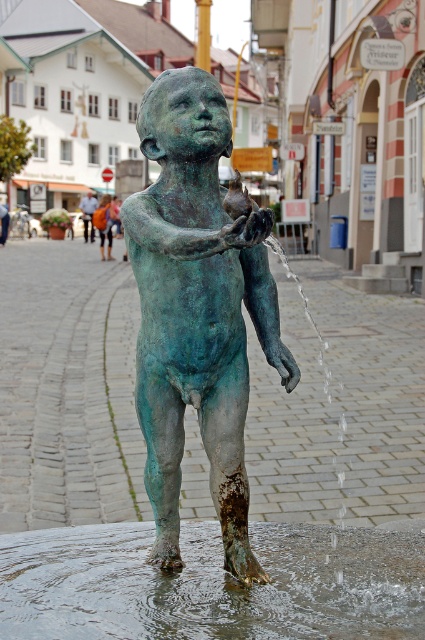
Which of these two, green patina statue at center or clear liquid water at lower center, stands shorter?

clear liquid water at lower center

Is green patina statue at center further to the viewer compared to clear liquid water at lower center?

No, green patina statue at center is closer to the viewer.

Find the location of a particular element. The height and width of the screenshot is (640, 425). green patina statue at center is located at coordinates (197, 310).

Locate an element on the screen. green patina statue at center is located at coordinates (197, 310).

Can you confirm if orange fabric bag at center is positioned above orange fabric backpack at center?

No, orange fabric bag at center is not above orange fabric backpack at center.

Is point (110, 195) positioned behind point (90, 196)?

Yes.

I want to click on orange fabric bag at center, so click(x=104, y=225).

At what (x,y) coordinates should I click in order to perform the action: click on orange fabric bag at center. Please return your answer as a coordinate pair (x, y). Looking at the image, I should click on (104, 225).

Is clear liquid water at lower center positioned at the back of orange fabric backpack at center?

No.

Does clear liquid water at lower center appear on the left side of orange fabric backpack at center?

In fact, clear liquid water at lower center is to the right of orange fabric backpack at center.

The width and height of the screenshot is (425, 640). Find the location of `clear liquid water at lower center`. clear liquid water at lower center is located at coordinates (212, 584).

Locate an element on the screen. clear liquid water at lower center is located at coordinates (212, 584).